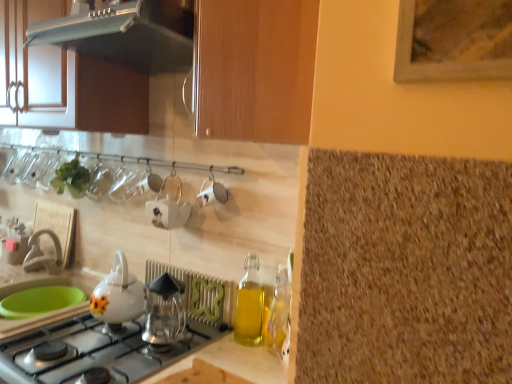
Question: Does transparent glass coffee maker at center, the first kitchen appliance when ordered from bottom to top, appear on the right side of white ceramic teapot at center?

Choices:
 (A) no
 (B) yes

Answer: (B)

Question: Considering the relative positions of transparent glass coffee maker at center, the first kitchen appliance when ordered from bottom to top, and white ceramic teapot at center in the image provided, is transparent glass coffee maker at center, the first kitchen appliance when ordered from bottom to top, behind white ceramic teapot at center?

Choices:
 (A) yes
 (B) no

Answer: (B)

Question: Is transparent glass coffee maker at center, the 3th kitchen appliance in the top-to-bottom sequence, positioned in front of white ceramic teapot at center?

Choices:
 (A) yes
 (B) no

Answer: (A)

Question: From a real-world perspective, is transparent glass coffee maker at center, the 3th kitchen appliance in the top-to-bottom sequence, positioned over white ceramic teapot at center based on gravity?

Choices:
 (A) no
 (B) yes

Answer: (A)

Question: Does transparent glass coffee maker at center, the first kitchen appliance when ordered from bottom to top, turn towards white ceramic teapot at center?

Choices:
 (A) yes
 (B) no

Answer: (B)

Question: Is matte white faucet at lower left situated inside white glossy teapot at lower left, which is the 2th kitchen appliance in bottom-to-top order, or outside?

Choices:
 (A) inside
 (B) outside

Answer: (B)

Question: From a real-world perspective, relative to white glossy teapot at lower left, which is the 2th kitchen appliance in bottom-to-top order, is matte white faucet at lower left vertically above or below?

Choices:
 (A) below
 (B) above

Answer: (A)

Question: From the image's perspective, relative to white glossy teapot at lower left, the second kitchen appliance viewed from the top, is matte white faucet at lower left above or below?

Choices:
 (A) below
 (B) above

Answer: (B)

Question: In terms of size, does matte white faucet at lower left appear bigger or smaller than white glossy teapot at lower left, which is the 2th kitchen appliance in bottom-to-top order?

Choices:
 (A) big
 (B) small

Answer: (B)

Question: In terms of size, does transparent glass coffee maker at center, the 3th kitchen appliance in the top-to-bottom sequence, appear bigger or smaller than clear glass vase at upper left, the second tableware in the front-to-back sequence?

Choices:
 (A) big
 (B) small

Answer: (A)

Question: From a real-world perspective, is transparent glass coffee maker at center, the first kitchen appliance when ordered from bottom to top, physically located above or below clear glass vase at upper left, arranged as the 1th tableware when viewed from the back?

Choices:
 (A) below
 (B) above

Answer: (A)

Question: From the image's perspective, is transparent glass coffee maker at center, the first kitchen appliance when ordered from bottom to top, located above or below clear glass vase at upper left, the 1th tableware positioned from the left?

Choices:
 (A) below
 (B) above

Answer: (A)

Question: Does point (182, 284) appear closer or farther from the camera than point (53, 170)?

Choices:
 (A) closer
 (B) farther

Answer: (A)

Question: In terms of width, does translucent glass bottle at right look wider or thinner when compared to white glossy teapot at lower left, which is the 2th kitchen appliance in bottom-to-top order?

Choices:
 (A) thin
 (B) wide

Answer: (A)

Question: Looking at the image, does translucent glass bottle at right seem bigger or smaller compared to white glossy teapot at lower left, the second kitchen appliance viewed from the top?

Choices:
 (A) small
 (B) big

Answer: (A)